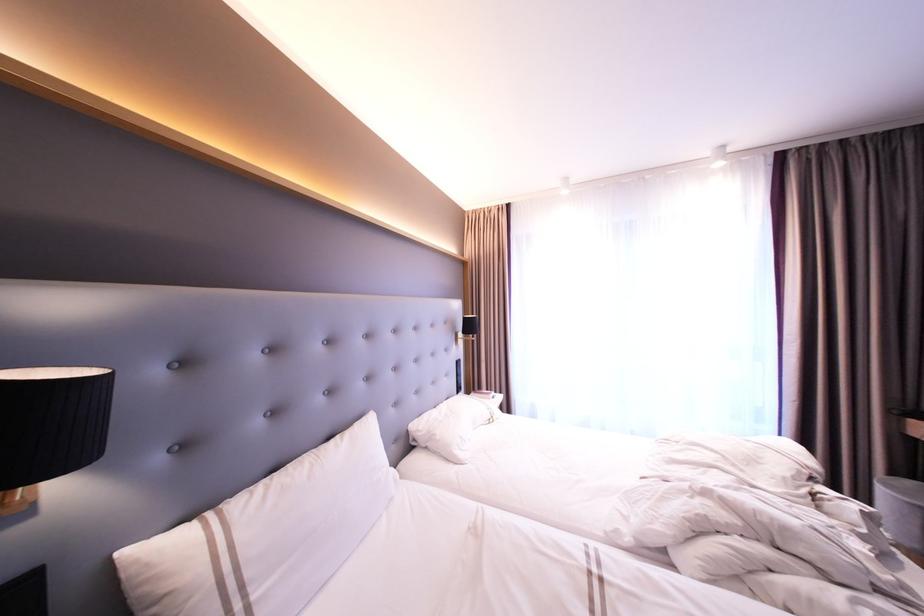
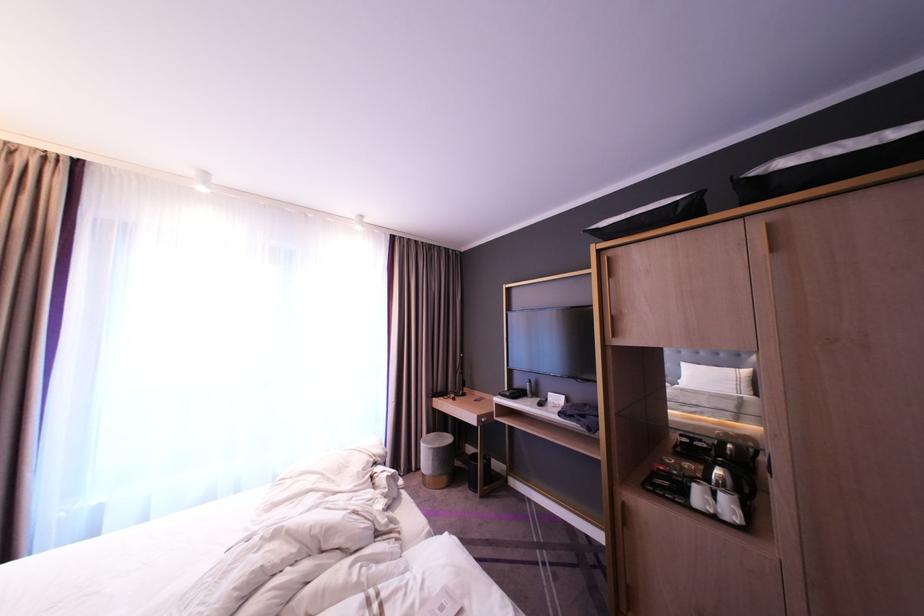
Question: The first image is from the beginning of the video and the second image is from the end. How did the camera likely rotate when shooting the video?

Choices:
 (A) Left
 (B) Right
 (C) Up
 (D) Down

Answer: (B)